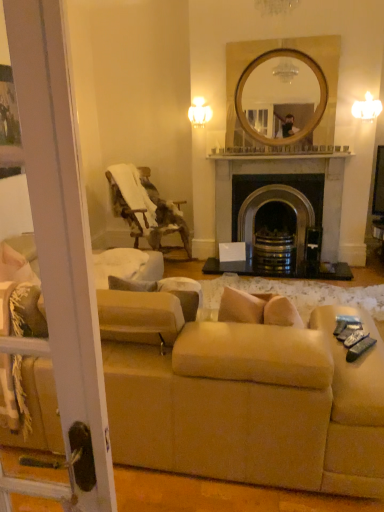
Question: Considering the positions of beige fabric couch at lower center and wooden textured chair at left in the image, is beige fabric couch at lower center wider or thinner than wooden textured chair at left?

Choices:
 (A) wide
 (B) thin

Answer: (A)

Question: Considering the relative positions of beige fabric couch at lower center and wooden textured chair at left in the image provided, is beige fabric couch at lower center to the left or to the right of wooden textured chair at left?

Choices:
 (A) right
 (B) left

Answer: (A)

Question: Estimate the real-world distances between objects in this image. Which object is closer to the wooden textured chair at left?

Choices:
 (A) black stone fireplace at center
 (B) beige fabric couch at lower center

Answer: (A)

Question: Which is farther from the wooden textured chair at left?

Choices:
 (A) beige fabric couch at lower center
 (B) black stone fireplace at center

Answer: (A)